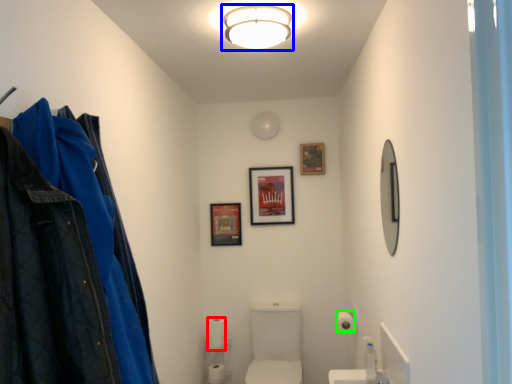
Question: Which object is the farthest from toilet paper (highlighted by a red box)? Choose among these: fixture (highlighted by a blue box) or toilet paper (highlighted by a green box).

Choices:
 (A) fixture
 (B) toilet paper

Answer: (A)